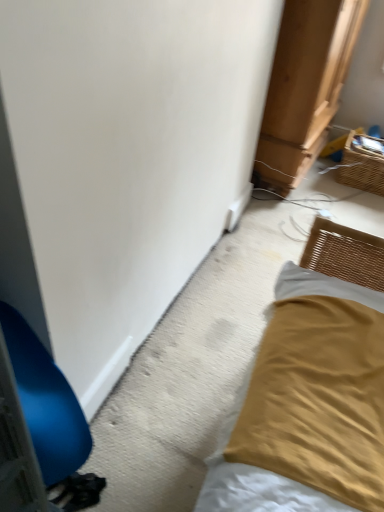
Question: Can you confirm if woven brown basket at upper right is shorter than blue plastic chair at left?

Choices:
 (A) yes
 (B) no

Answer: (A)

Question: From the image's perspective, would you say woven brown basket at upper right is shown under blue plastic chair at left?

Choices:
 (A) no
 (B) yes

Answer: (A)

Question: Is there a large distance between woven brown basket at upper right and blue plastic chair at left?

Choices:
 (A) yes
 (B) no

Answer: (A)

Question: Is woven brown basket at upper right facing away from blue plastic chair at left?

Choices:
 (A) no
 (B) yes

Answer: (A)

Question: Is woven brown basket at upper right to the left of blue plastic chair at left from the viewer's perspective?

Choices:
 (A) no
 (B) yes

Answer: (A)

Question: From a real-world perspective, is woven brown basket at upper right positioned over blue plastic chair at left based on gravity?

Choices:
 (A) no
 (B) yes

Answer: (A)

Question: Are blue plastic chair at left and woven brown basket at upper right far apart?

Choices:
 (A) no
 (B) yes

Answer: (B)

Question: Does blue plastic chair at left appear on the left side of woven brown basket at upper right?

Choices:
 (A) yes
 (B) no

Answer: (A)

Question: Is blue plastic chair at left positioned beyond the bounds of woven brown basket at upper right?

Choices:
 (A) no
 (B) yes

Answer: (B)

Question: From the image's perspective, would you say blue plastic chair at left is positioned over woven brown basket at upper right?

Choices:
 (A) no
 (B) yes

Answer: (A)

Question: Is blue plastic chair at left placed right next to woven brown basket at upper right?

Choices:
 (A) yes
 (B) no

Answer: (B)

Question: Is blue plastic chair at left closer to camera compared to woven brown basket at upper right?

Choices:
 (A) no
 (B) yes

Answer: (B)

Question: In terms of height, does woven brown basket at upper right look taller or shorter compared to blue plastic chair at left?

Choices:
 (A) short
 (B) tall

Answer: (A)